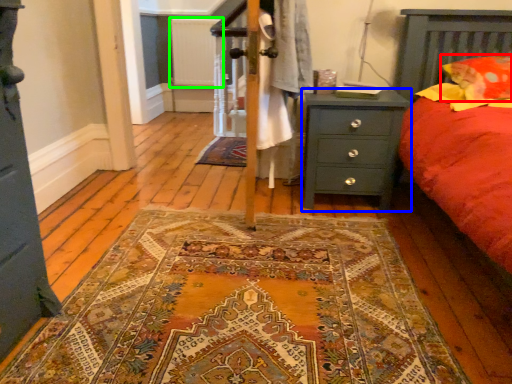
Question: Based on their relative distances, which object is nearer to pillow (highlighted by a red box)? Choose from nightstand (highlighted by a blue box) and radiator (highlighted by a green box).

Choices:
 (A) nightstand
 (B) radiator

Answer: (A)